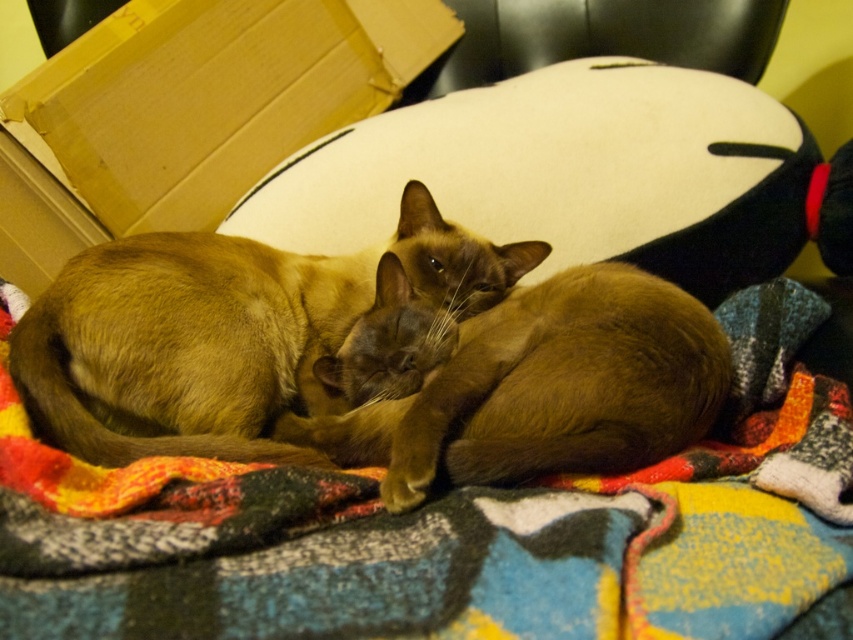
Does multicolored woven blanket at center appear on the right side of brown silky cat at center?

Indeed, multicolored woven blanket at center is positioned on the right side of brown silky cat at center.

Who is higher up, multicolored woven blanket at center or brown silky cat at center?

brown silky cat at center

Is point (1, 324) farther from viewer compared to point (286, 296)?

No, (1, 324) is in front of (286, 296).

I want to click on multicolored woven blanket at center, so click(x=457, y=531).

Does point (509, 492) come behind point (660, 452)?

No, it is in front of (660, 452).

Does point (662, 634) lie in front of point (531, 317)?

That is True.

Is point (802, 401) in front of point (693, 339)?

No.

The height and width of the screenshot is (640, 853). I want to click on multicolored woven blanket at center, so tap(457, 531).

Does cardboard box at upper left have a lesser height compared to brown silky cat at center?

In fact, cardboard box at upper left may be taller than brown silky cat at center.

Is point (337, 93) positioned behind point (135, 273)?

Yes, it is behind point (135, 273).

Between point (271, 163) and point (477, 301), which one is positioned in front?

Positioned in front is point (477, 301).

Where is `cardboard box at upper left`? This screenshot has height=640, width=853. cardboard box at upper left is located at coordinates (187, 113).